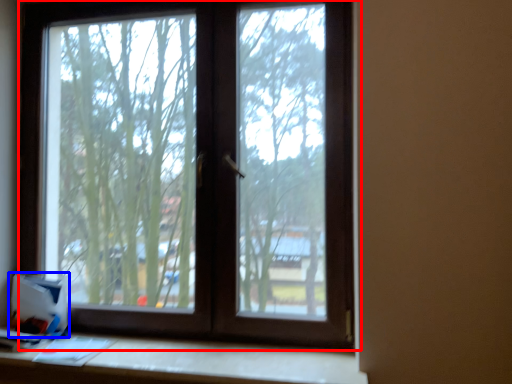
Question: Which object is closer to the camera taking this photo, window (highlighted by a red box) or cardboard box (highlighted by a blue box)?

Choices:
 (A) window
 (B) cardboard box

Answer: (A)